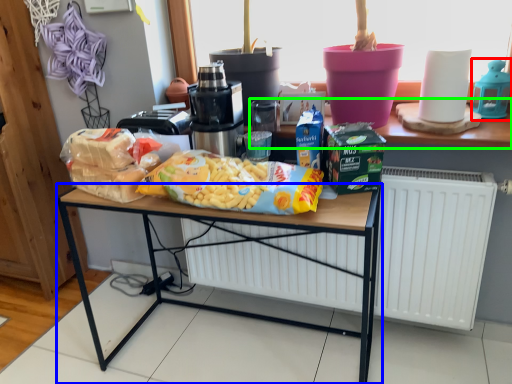
Question: Which object is positioned closest to appliance (highlighted by a red box)? Select from desk (highlighted by a blue box) and window sill (highlighted by a green box).

Choices:
 (A) desk
 (B) window sill

Answer: (B)